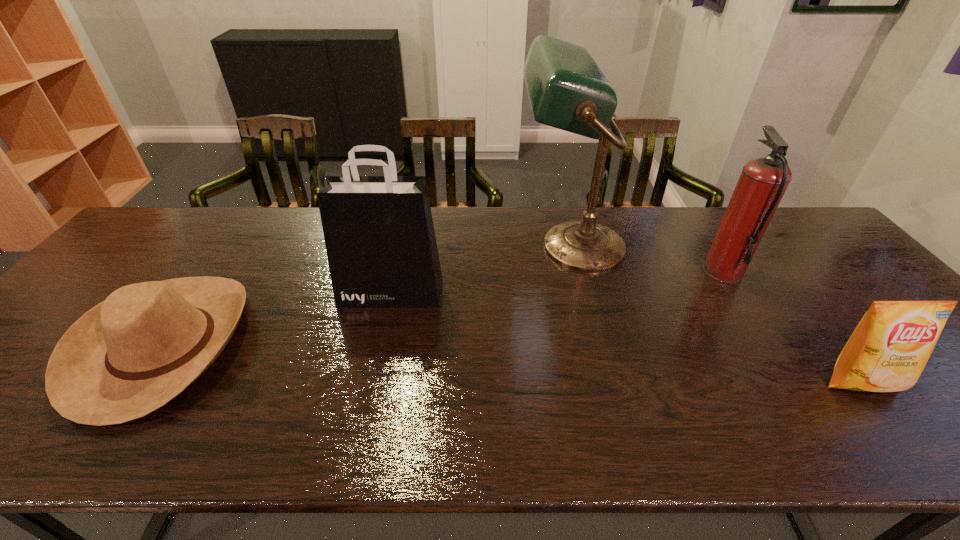
Where is `object that is positioned at the near left corner`? The height and width of the screenshot is (540, 960). object that is positioned at the near left corner is located at coordinates (132, 353).

Locate an element on the screen. vacant region at the far edge of the desktop is located at coordinates (281, 227).

Where is `free space at the near edge of the desktop`? The width and height of the screenshot is (960, 540). free space at the near edge of the desktop is located at coordinates (156, 420).

Find the location of a particular element. The image size is (960, 540). vacant space at the left edge of the desktop is located at coordinates 139,273.

Find the location of a particular element. The height and width of the screenshot is (540, 960). free space at the far right corner of the desktop is located at coordinates coord(787,213).

Locate an element on the screen. Image resolution: width=960 pixels, height=540 pixels. vacant point located between the fire extinguisher and the cowboy hat is located at coordinates (444, 308).

Locate an element on the screen. free area in between the rightmost object and the fire extinguisher is located at coordinates (792, 327).

Locate an element on the screen. The image size is (960, 540). vacant space that's between the fire extinguisher and the shortest object is located at coordinates (444, 308).

You are a GUI agent. You are given a task and a screenshot of the screen. Output one action in this format:
    pyautogui.click(x=<x>, y=<y>)
    Task: Click on the free spot between the shopping bag and the tallest object
    
    Given the screenshot: What is the action you would take?
    pyautogui.click(x=481, y=269)

Identify the location of free point between the table lamp and the shopping bag. The image size is (960, 540). (481, 269).